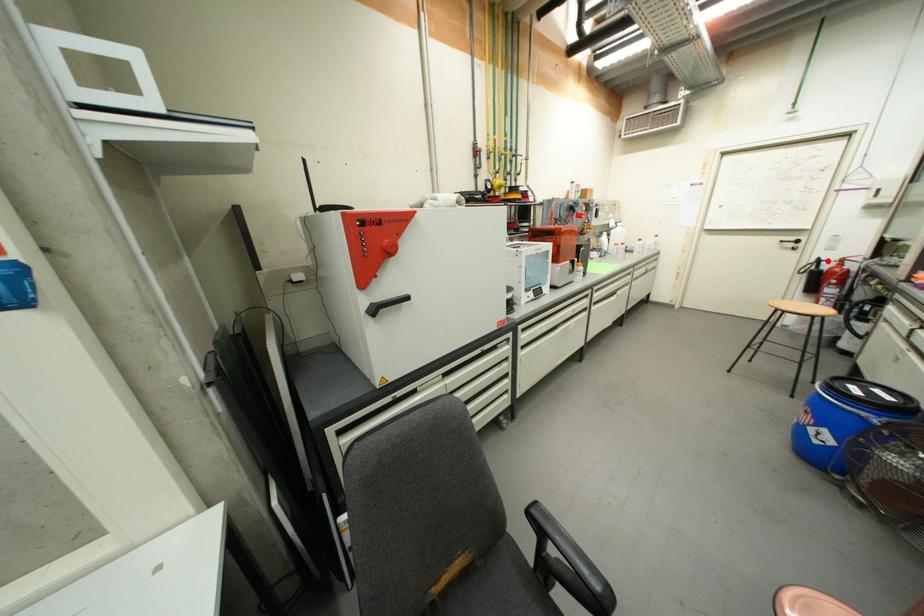
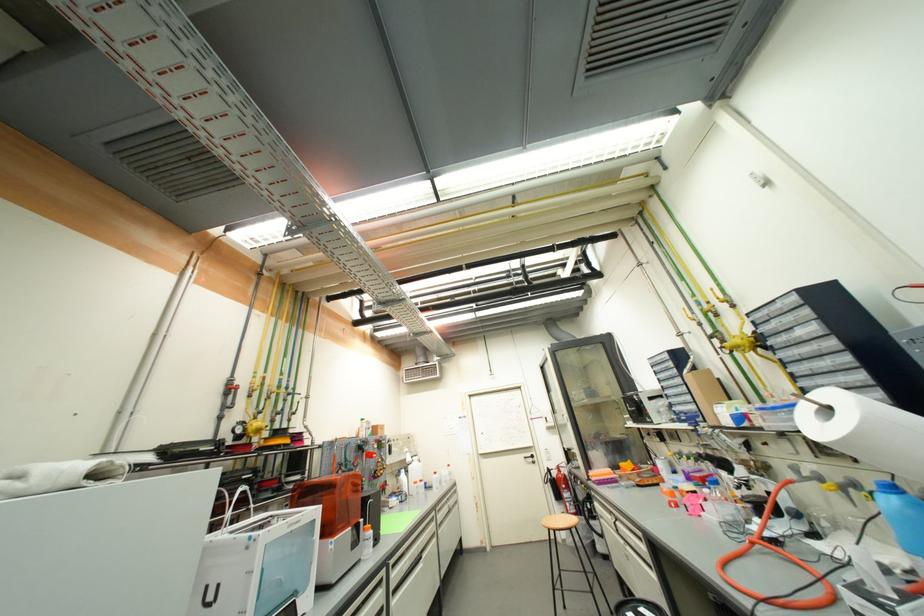
Question: I am providing you with two images of the same scene from different viewpoints. A red point is shown in image1. For the corresponding object point in image2, is it positioned nearer or farther from the camera?

Choices:
 (A) Nearer
 (B) Farther

Answer: (B)